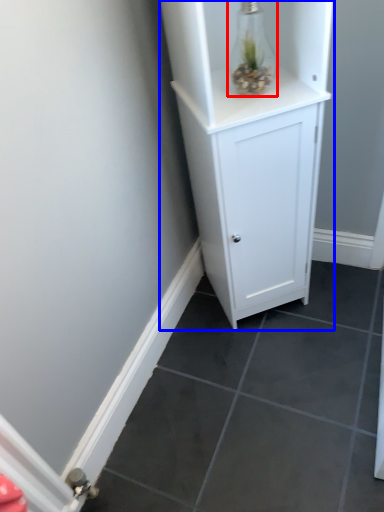
Question: Which object is closer to the camera taking this photo, glass vase (highlighted by a red box) or cupboard (highlighted by a blue box)?

Choices:
 (A) glass vase
 (B) cupboard

Answer: (B)